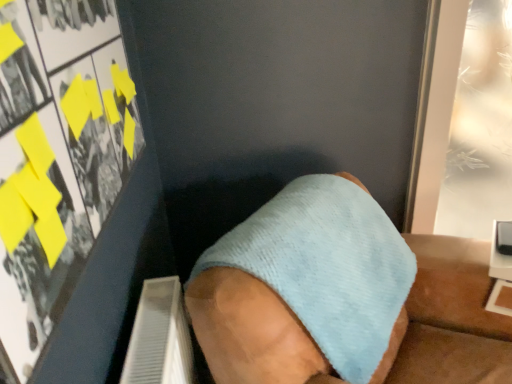
Question: Can you see transparent glass door at upper right, placed as the 1th poster page when sorted from back to front, touching matte paper poster at upper left, arranged as the 1th poster page when viewed from the front?

Choices:
 (A) yes
 (B) no

Answer: (B)

Question: Is the position of transparent glass door at upper right, the first poster page positioned from the right, less distant than that of matte paper poster at upper left, the 2th poster page when ordered from back to front?

Choices:
 (A) no
 (B) yes

Answer: (A)

Question: Is transparent glass door at upper right, placed as the 2th poster page when sorted from front to back, smaller than matte paper poster at upper left, the first poster page positioned from the left?

Choices:
 (A) no
 (B) yes

Answer: (A)

Question: Does transparent glass door at upper right, placed as the 1th poster page when sorted from back to front, appear on the right side of matte paper poster at upper left, the first poster page positioned from the left?

Choices:
 (A) yes
 (B) no

Answer: (A)

Question: Is transparent glass door at upper right, placed as the 1th poster page when sorted from back to front, facing towards matte paper poster at upper left, arranged as the 1th poster page when viewed from the front?

Choices:
 (A) yes
 (B) no

Answer: (B)

Question: Is transparent glass door at upper right, placed as the 1th poster page when sorted from back to front, thinner than matte paper poster at upper left, the first poster page positioned from the left?

Choices:
 (A) yes
 (B) no

Answer: (B)

Question: Can you confirm if light blue fabric sock at center is shorter than matte paper poster at upper left, arranged as the 1th poster page when viewed from the front?

Choices:
 (A) yes
 (B) no

Answer: (A)

Question: Can you confirm if light blue fabric sock at center is thinner than matte paper poster at upper left, arranged as the 1th poster page when viewed from the front?

Choices:
 (A) no
 (B) yes

Answer: (A)

Question: Does light blue fabric sock at center contain matte paper poster at upper left, the 2th poster page when ordered from back to front?

Choices:
 (A) no
 (B) yes

Answer: (A)

Question: Can you confirm if light blue fabric sock at center is positioned to the left of matte paper poster at upper left, the 2th poster page when ordered from back to front?

Choices:
 (A) yes
 (B) no

Answer: (B)

Question: Is light blue fabric sock at center aimed at matte paper poster at upper left, the first poster page positioned from the left?

Choices:
 (A) yes
 (B) no

Answer: (B)

Question: Is light blue fabric sock at center facing away from matte paper poster at upper left, arranged as the 1th poster page when viewed from the front?

Choices:
 (A) yes
 (B) no

Answer: (B)

Question: From the image's perspective, is transparent glass door at upper right, placed as the 2th poster page when sorted from front to back, above light blue fabric sock at center?

Choices:
 (A) no
 (B) yes

Answer: (B)